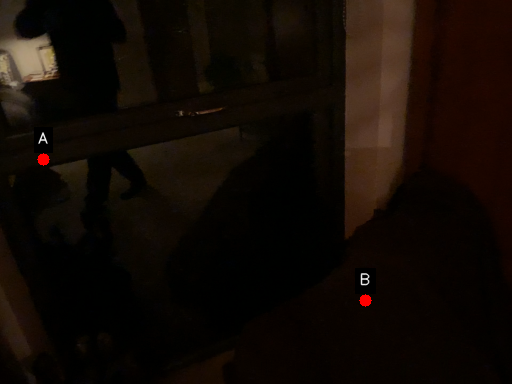
Question: Two points are circled on the image, labeled by A and B beside each circle. Which point is farther from the camera taking this photo?

Choices:
 (A) A is further
 (B) B is further

Answer: (B)